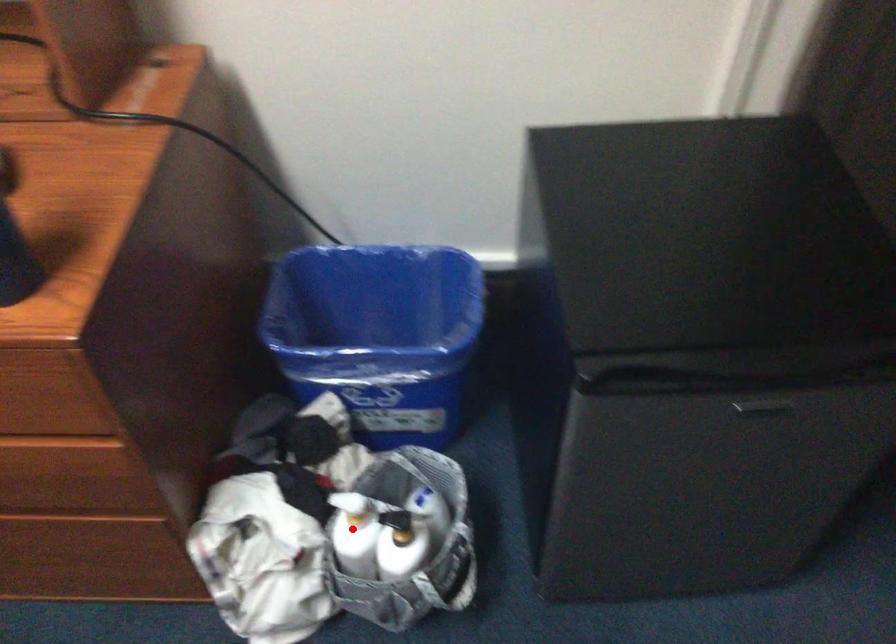
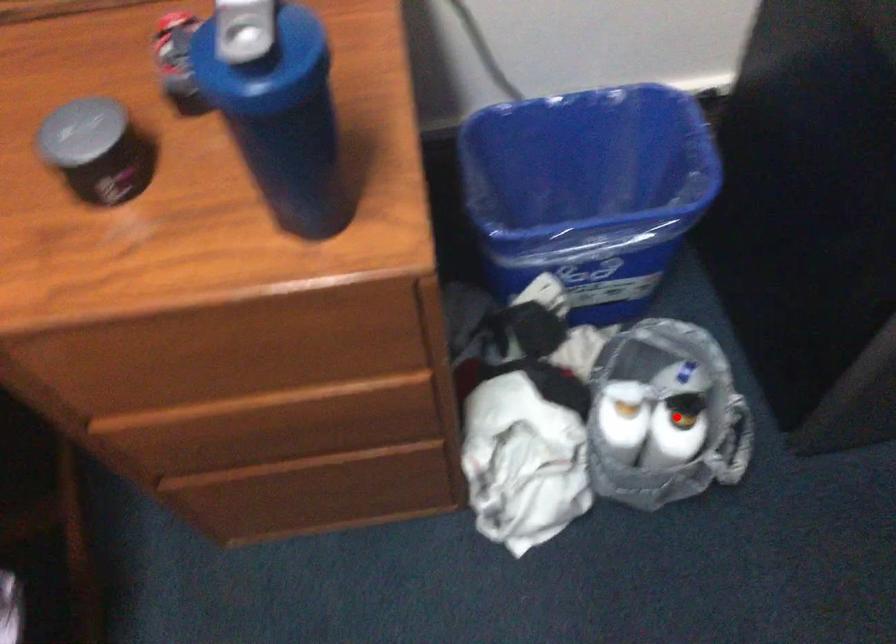
I am providing you with two images of the same scene from different viewpoints. A red point is marked on the first image and another point is marked on the second image. Does the point marked in image1 correspond to the same location as the one in image2?

No